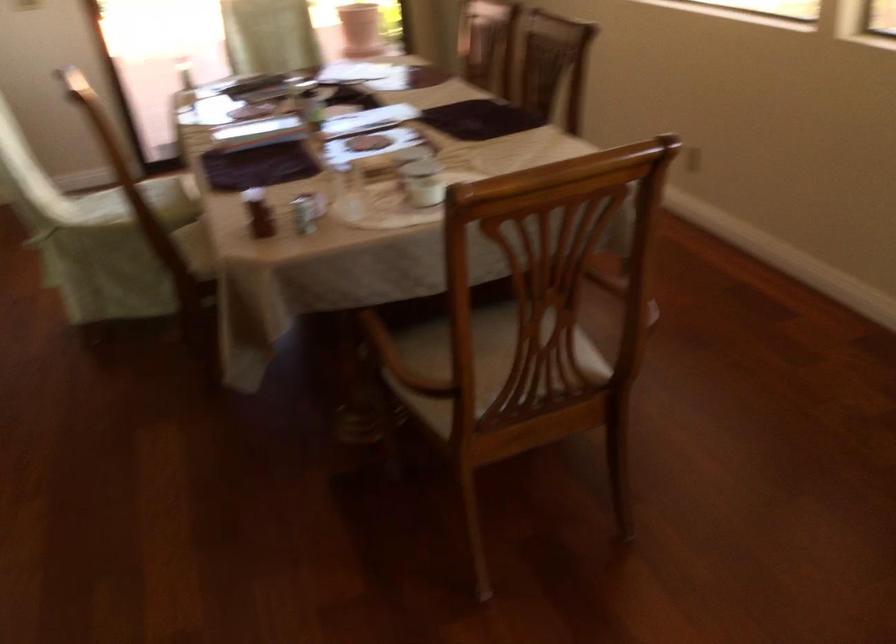
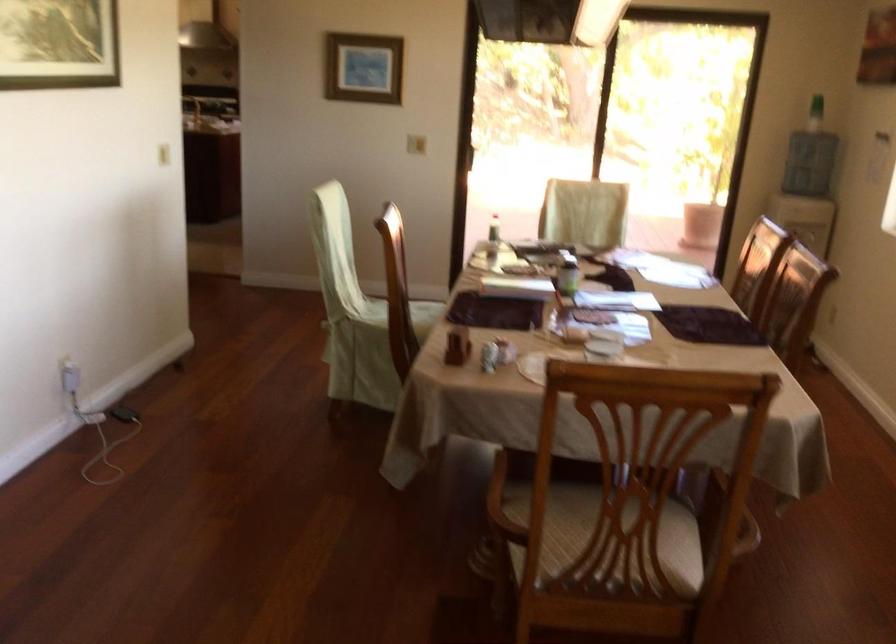
Where in the second image is the point corresponding to the point at 632,289 from the first image?

(722, 509)